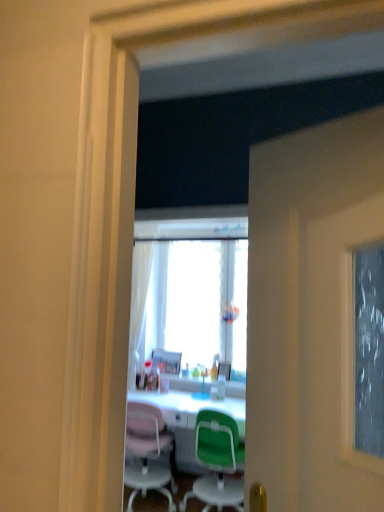
Question: Visually, is white glossy desk at center positioned to the left or to the right of translucent plastic bottle at center?

Choices:
 (A) right
 (B) left

Answer: (B)

Question: Relative to translucent plastic bottle at center, is white glossy desk at center in front or behind?

Choices:
 (A) behind
 (B) front

Answer: (B)

Question: Which of these objects is positioned farthest from the matte plastic picture frame at center, the second picture frame viewed from the front?

Choices:
 (A) transparent glass window at center
 (B) green plastic chair at center
 (C) white glossy desk at center
 (D) metallic silver picture frame at center, which is the 2th picture frame in left-to-right order
 (E) translucent plastic bottle at center

Answer: (B)

Question: Which of these objects is positioned farthest from the translucent plastic bottle at center?

Choices:
 (A) white glossy desk at center
 (B) green plastic chair at center
 (C) matte plastic picture frame at center, the second picture frame viewed from the front
 (D) metallic silver picture frame at center, the 1th picture frame when ordered from front to back
 (E) transparent glass window at center

Answer: (E)